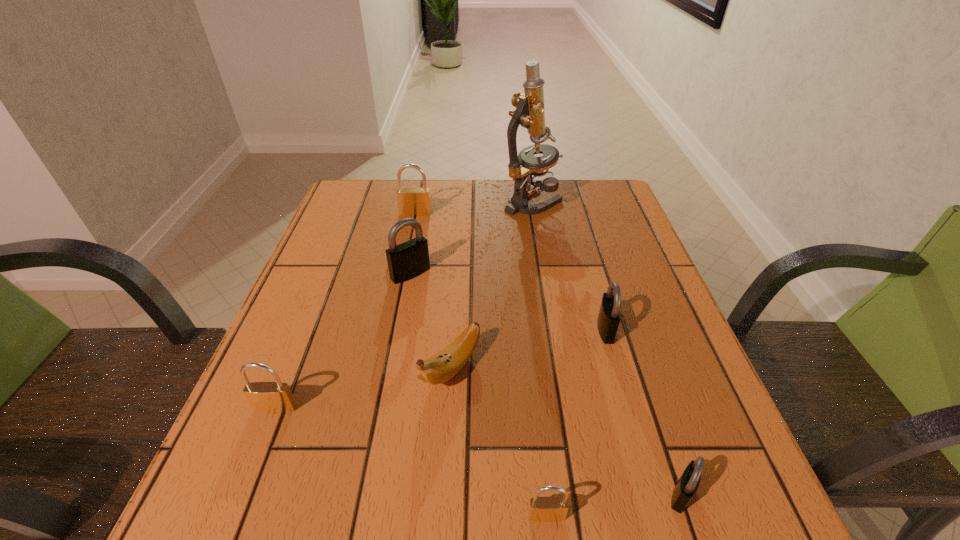
Find the location of a particular element. This screenshot has width=960, height=540. vacant space located 0.220m on the front of the fourth object from left to right is located at coordinates (442, 538).

Identify the location of free space located on the back of the rightmost object. (661, 434).

The image size is (960, 540). I want to click on microscope that is at the far edge, so click(530, 113).

You are a GUI agent. You are given a task and a screenshot of the screen. Output one action in this format:
    pyautogui.click(x=<x>, y=<y>)
    Task: Click on the padlock present at the far edge
    This screenshot has height=540, width=960.
    Given the screenshot: What is the action you would take?
    pyautogui.click(x=411, y=201)

Locate an element on the screen. The image size is (960, 540). object situated at the left edge is located at coordinates (265, 397).

Image resolution: width=960 pixels, height=540 pixels. In order to click on object that is at the near right corner in this screenshot , I will do `click(686, 487)`.

This screenshot has width=960, height=540. In the image, there is a desktop. What are the coordinates of `free region at the near edge` in the screenshot? It's located at (615, 491).

You are a GUI agent. You are given a task and a screenshot of the screen. Output one action in this format:
    pyautogui.click(x=<x>, y=<y>)
    Task: Click on the vacant region at the left edge of the desktop
    Image resolution: width=960 pixels, height=540 pixels.
    Given the screenshot: What is the action you would take?
    pyautogui.click(x=291, y=332)

Where is `free location at the right edge`? The image size is (960, 540). free location at the right edge is located at coordinates (741, 455).

At what (x,y) coordinates should I click in order to perform the action: click on vacant space at the near left corner. Please return your answer as a coordinate pair (x, y). This screenshot has height=540, width=960. Looking at the image, I should click on (195, 514).